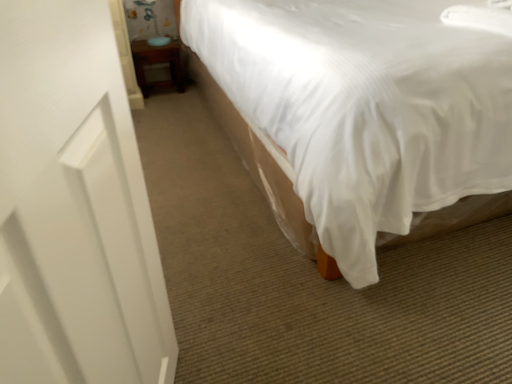
Find the location of a particular element. Image resolution: width=512 pixels, height=384 pixels. vacant space in front of wooden table at lower left is located at coordinates (164, 100).